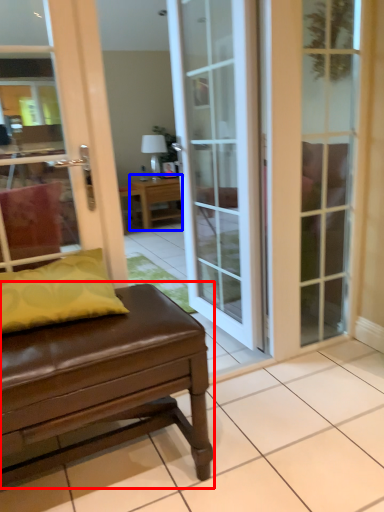
Question: Which of the following is the farthest to the observer, table (highlighted by a red box) or table (highlighted by a blue box)?

Choices:
 (A) table
 (B) table

Answer: (B)